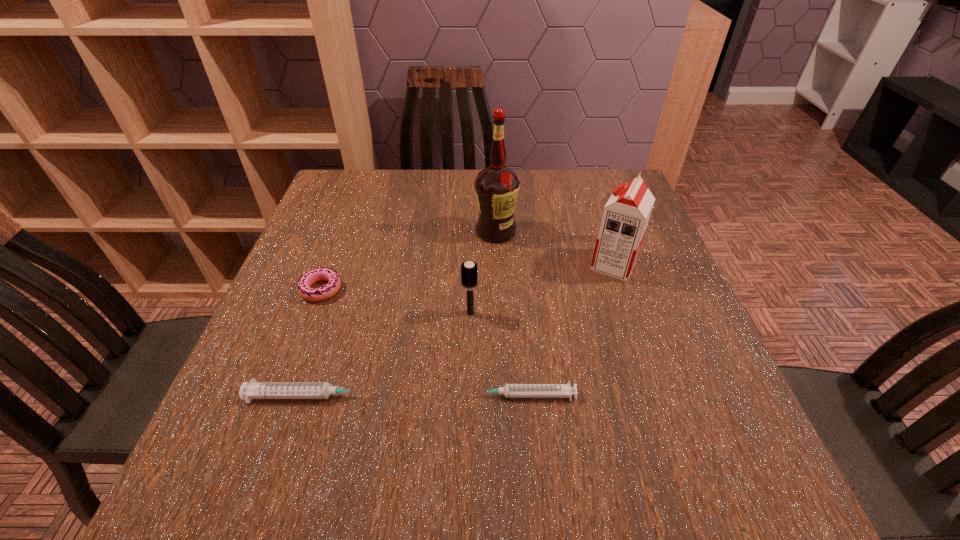
The width and height of the screenshot is (960, 540). In order to click on the left syringe in this screenshot , I will do `click(253, 390)`.

At what (x,y) coordinates should I click in order to perform the action: click on the right syringe. Please return your answer as a coordinate pair (x, y). The height and width of the screenshot is (540, 960). Looking at the image, I should click on (509, 390).

This screenshot has width=960, height=540. In order to click on the tallest object in this screenshot , I will do `click(496, 187)`.

Where is `the farthest object`? This screenshot has height=540, width=960. the farthest object is located at coordinates (496, 187).

Locate an element on the screen. soya milk is located at coordinates (625, 217).

Where is `the second tallest object`? the second tallest object is located at coordinates (625, 217).

Where is `doughnut`? doughnut is located at coordinates (310, 277).

You are a GUI agent. You are given a task and a screenshot of the screen. Output one action in this format:
    pyautogui.click(x=<x>, y=<y>)
    Task: Click on the third nearest object
    This screenshot has width=960, height=540.
    Given the screenshot: What is the action you would take?
    pyautogui.click(x=469, y=270)

Locate an element on the screen. the third tallest object is located at coordinates (469, 270).

Where is `free space located 0.370m at the needle end of the taller syringe`? This screenshot has height=540, width=960. free space located 0.370m at the needle end of the taller syringe is located at coordinates (581, 396).